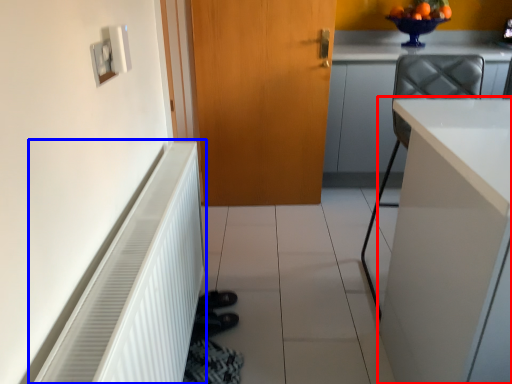
Question: Which object appears farthest to the camera in this image, cabinetry (highlighted by a red box) or radiator (highlighted by a blue box)?

Choices:
 (A) cabinetry
 (B) radiator

Answer: (A)